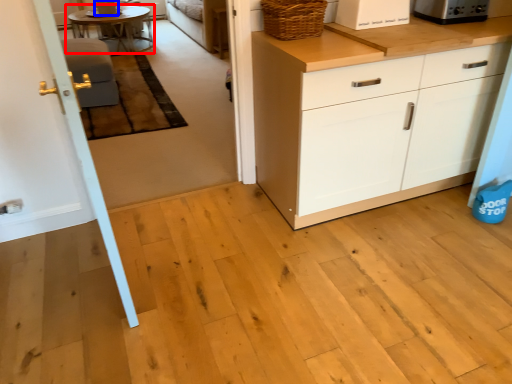
Question: Which of the following is the farthest to the observer, table (highlighted by a red box) or appliance (highlighted by a blue box)?

Choices:
 (A) table
 (B) appliance

Answer: (B)